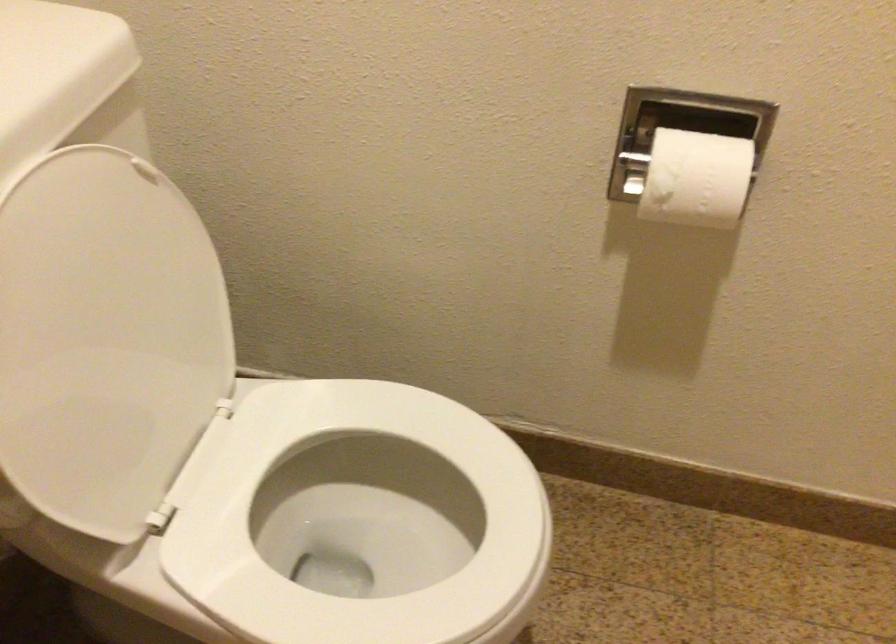
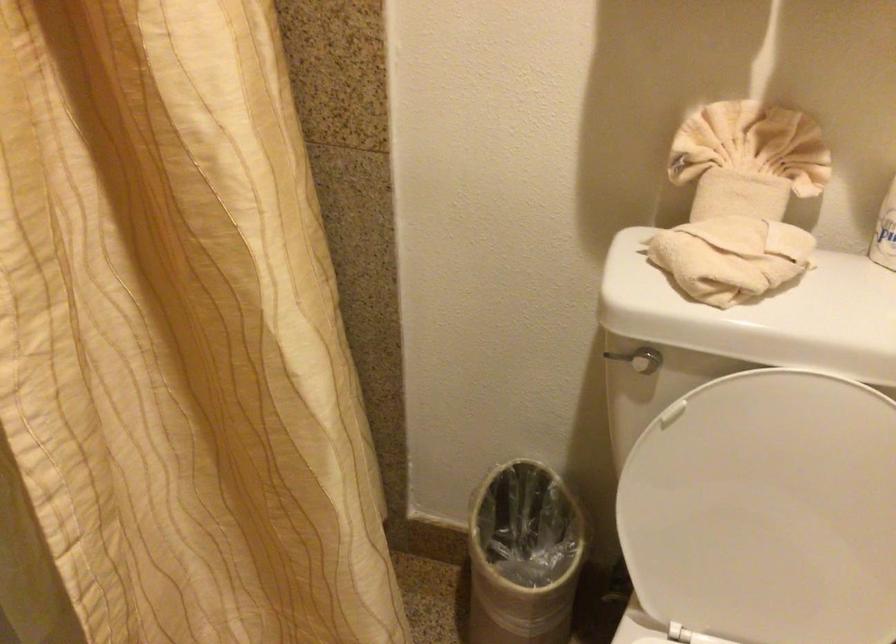
Locate, in the second image, the point that corresponds to the point at 110,343 in the first image.

(767, 511)